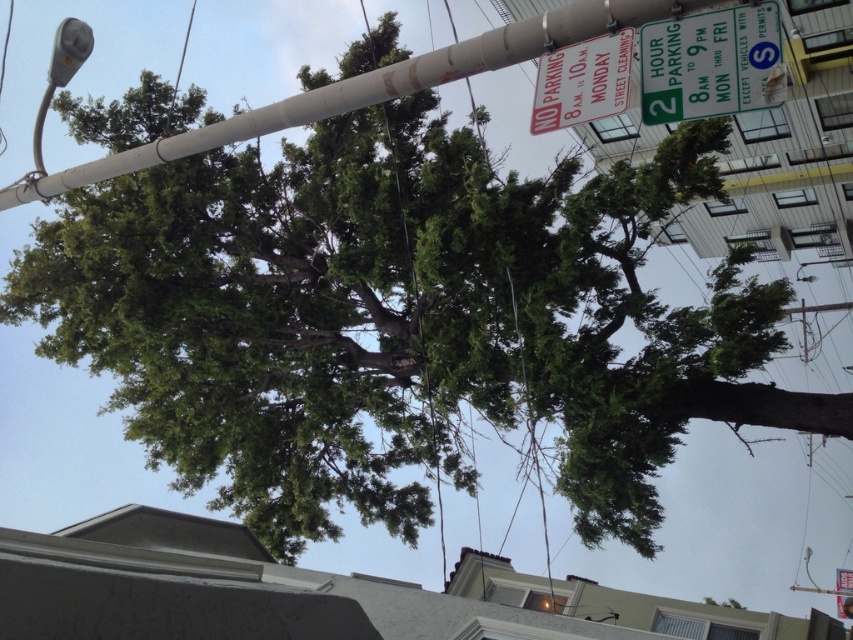
You are a driver looking for a parking spot near the large tree. You see the smooth gray pole at upper center and the green plastic parking sign at upper right. Which object is closer to the left side of the scene?

The smooth gray pole at upper center is positioned on the left side of green plastic parking sign at upper right, so it is closer to the left side of the scene.

You are a driver trying to park your car on Monday morning at 8 A.M. You see the green plastic parking sign at upper right and the metallic gray streetlight at upper left. Which sign should you pay attention to first?

The green plastic parking sign at upper right is in front of the metallic gray streetlight at upper left, so you should pay attention to the green plastic parking sign at upper right first as it is closer to your view.

You are a driver looking for a parking spot near the large tree. You see the green plastic parking sign at upper right and the metallic gray streetlight at upper left. Which object is located to the right of the other?

The green plastic parking sign at upper right is positioned on the right side of metallic gray streetlight at upper left.